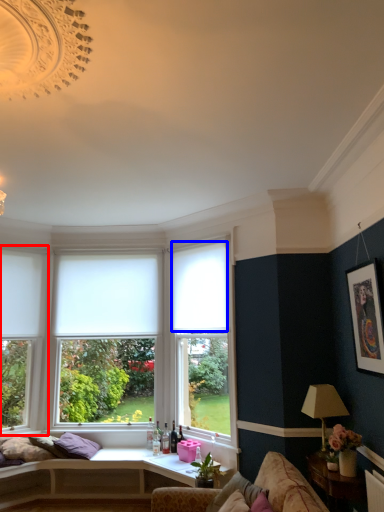
Question: Which of the following is the farthest to the observer, window (highlighted by a red box) or curtain (highlighted by a blue box)?

Choices:
 (A) window
 (B) curtain

Answer: (A)